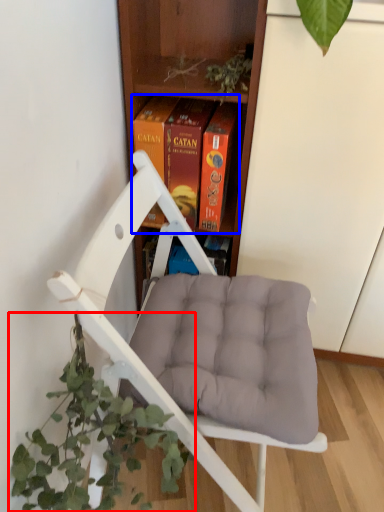
Question: Which of the following is the farthest to the observer, houseplant (highlighted by a red box) or book (highlighted by a blue box)?

Choices:
 (A) houseplant
 (B) book

Answer: (B)